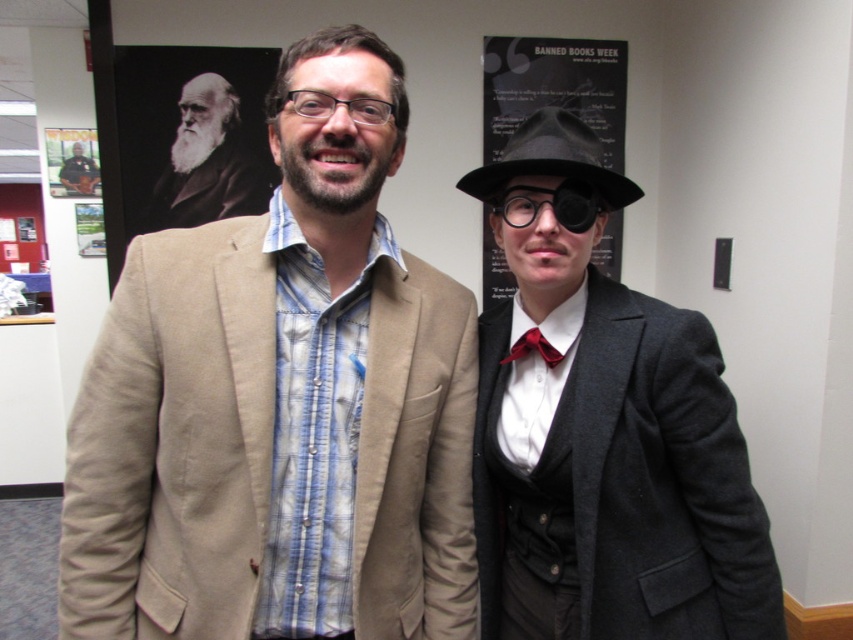
Question: Considering the real-world distances, which object is farthest from the matte black coat at right?

Choices:
 (A) gray beard at upper left
 (B) tan fabric jacket at center

Answer: (A)

Question: Can you confirm if clear plastic goggles at center is positioned to the left of matte red bow tie at center?

Choices:
 (A) no
 (B) yes

Answer: (A)

Question: Can you confirm if matte black coat at right is positioned to the right of black matte poster at upper center?

Choices:
 (A) no
 (B) yes

Answer: (A)

Question: Can you confirm if black felt fedora at right is bigger than matte red bow tie at center?

Choices:
 (A) yes
 (B) no

Answer: (A)

Question: Which point is closer to the camera?

Choices:
 (A) gray beard at upper left
 (B) matte black jacket at center
 (C) clear plastic goggles at center

Answer: (C)

Question: Which point is closer to the camera taking this photo?

Choices:
 (A) (373, 573)
 (B) (508, 275)
 (C) (77, 173)
 (D) (523, 348)

Answer: (A)